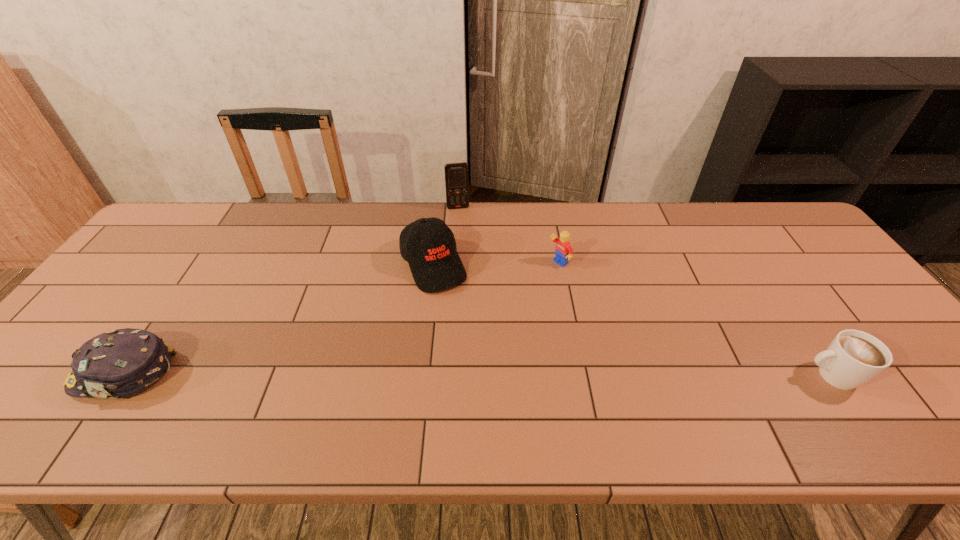
The width and height of the screenshot is (960, 540). What are the coordinates of `the second closest object relative to the tallest object` in the screenshot? It's located at (563, 251).

Locate which object is the closest to the baseball cap. Please provide its 2D coordinates. Your answer should be formatted as a tuple, i.e. [(x, y)], where the tuple contains the x and y coordinates of a point satisfying the conditions above.

[(456, 174)]

At what (x,y) coordinates should I click in order to perform the action: click on free space that satisfies the following two spatial constraints: 1. on the back side of the baseball cap; 2. on the right side of the cellular telephone. Please return your answer as a coordinate pair (x, y). This screenshot has width=960, height=540. Looking at the image, I should click on (440, 208).

Locate an element on the screen. This screenshot has width=960, height=540. vacant area that satisfies the following two spatial constraints: 1. on the front side of the cappuccino; 2. with the handle on the side of the baseball cap is located at coordinates (420, 376).